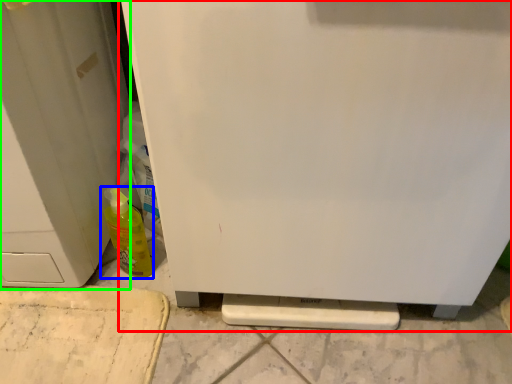
Question: Considering the real-world distances, which object is farthest from refrigerator (highlighted by a red box)? bottle (highlighted by a blue box) or door (highlighted by a green box)?

Choices:
 (A) bottle
 (B) door

Answer: (A)